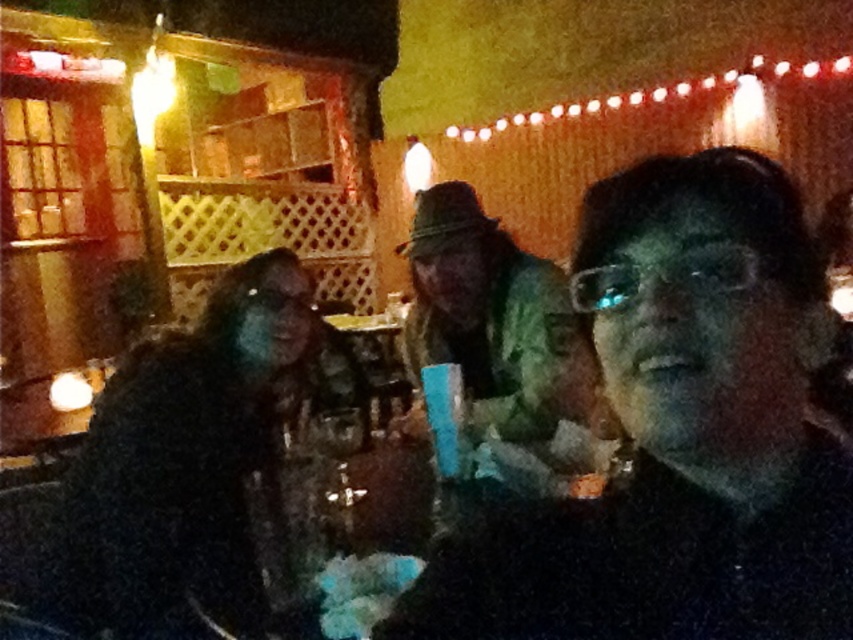
You are a bartender preparing to place a drink on the table where the matte black glasses at center and green camouflage jacket at center are present. Which object should you avoid placing the drink directly above to prevent it from falling?

You should avoid placing the drink directly above the matte black glasses at center because it is located below the green camouflage jacket at center, meaning the jacket is above the glasses. Placing the drink above the glasses might cause it to fall off since the jacket is in an elevated position.

You are standing at the entrance of the bar and want to walk towards the point at the coordinates point (297,291) and point (447,332). Which point should you aim for first if you want to reach the one closer to the entrance?

Point (297,291) is in front of point (447,332), so you should aim for point (297,291) first since it is closer to the entrance.